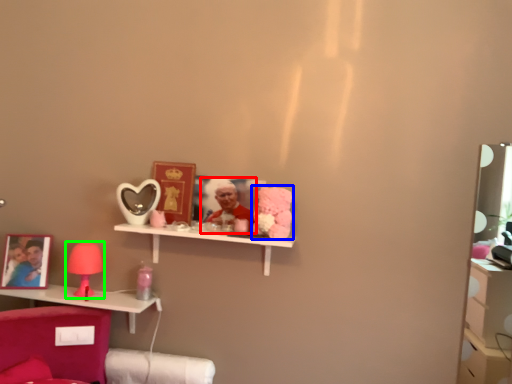
Question: Considering the real-world distances, which object is closest to person (highlighted by a red box)? toy (highlighted by a blue box) or table lamp (highlighted by a green box).

Choices:
 (A) toy
 (B) table lamp

Answer: (A)